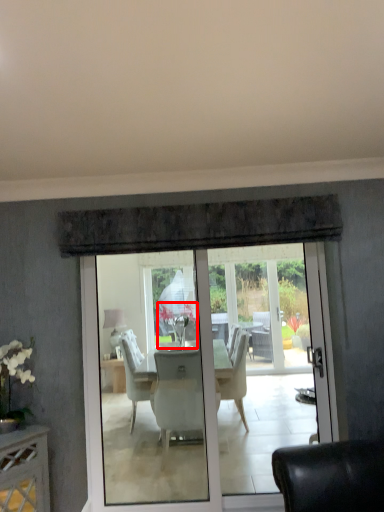
Question: From the image, what is the correct spatial relationship of flower (annotated by the red box) in relation to lamp?

Choices:
 (A) right
 (B) left

Answer: (A)